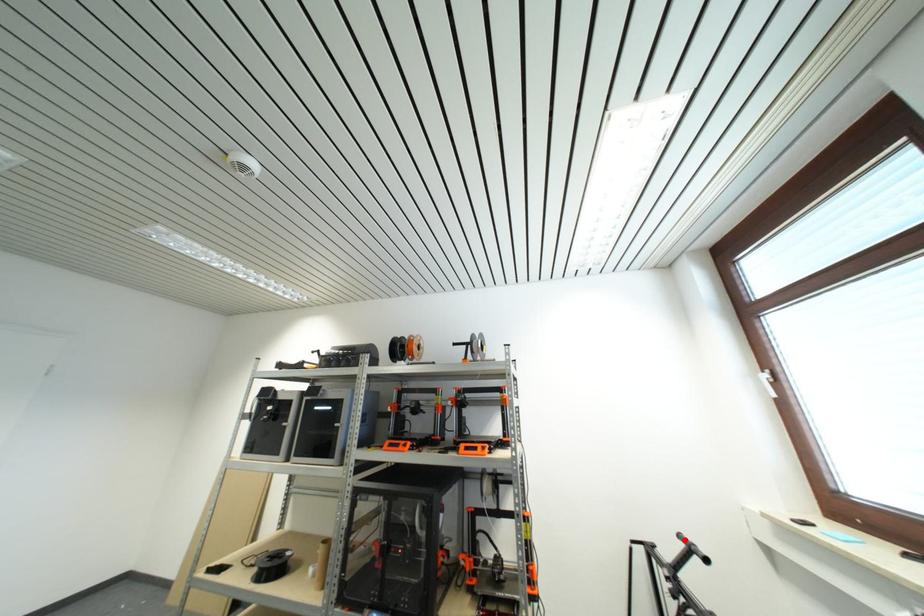
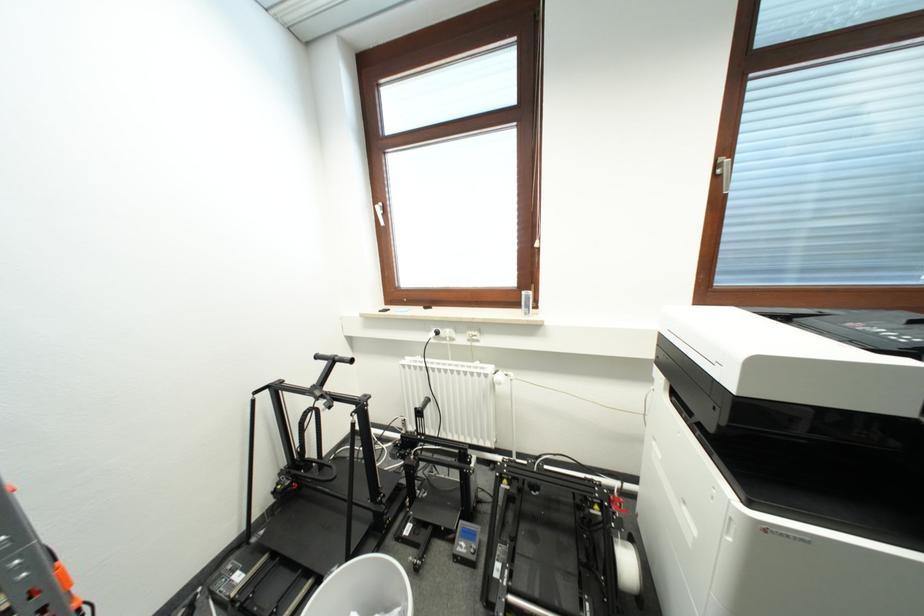
In the second image, find the point that corresponds to the highlighted location in the first image.

(322, 360)